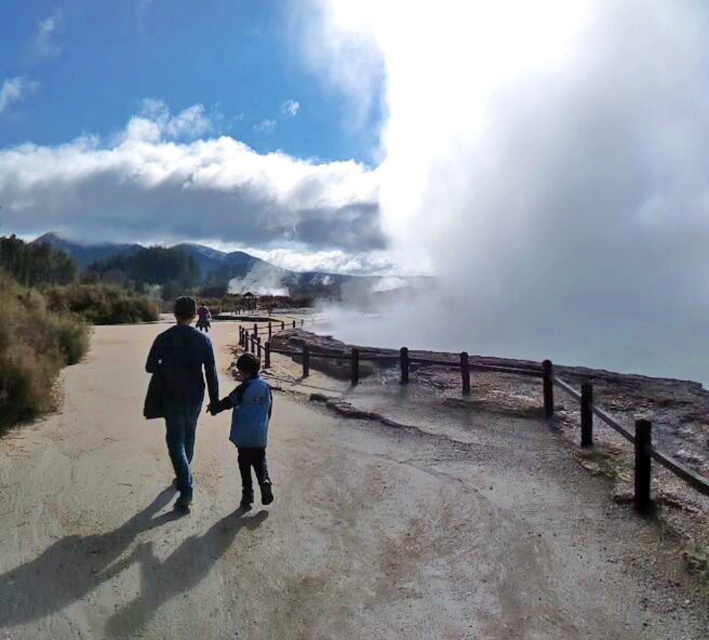
Question: Can you confirm if dirt track at center is wider than blue fabric jacket at center?

Choices:
 (A) no
 (B) yes

Answer: (B)

Question: Does dark blue fabric jacket at center come behind blue fabric jacket at center?

Choices:
 (A) yes
 (B) no

Answer: (A)

Question: Which point appears closest to the camera in this image?

Choices:
 (A) (178, 353)
 (B) (259, 433)
 (C) (89, 396)
 (D) (247, 244)

Answer: (B)

Question: Which point is farther to the camera?

Choices:
 (A) blue fabric jacket at center
 (B) white fluffy cloud at upper center
 (C) dark blue fabric jacket at center

Answer: (B)

Question: Which point is closer to the camera taking this photo?

Choices:
 (A) (372, 221)
 (B) (184, 464)
 (C) (262, 460)

Answer: (C)

Question: Does dirt track at center come in front of white fluffy cloud at upper center?

Choices:
 (A) yes
 (B) no

Answer: (A)